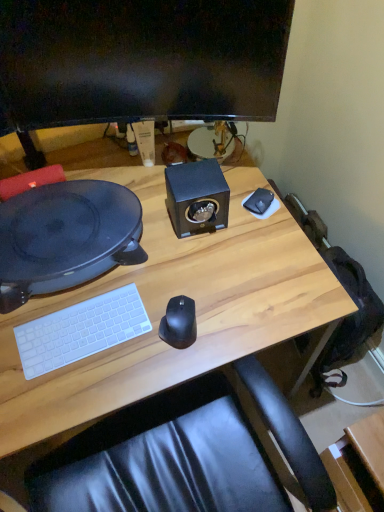
I want to click on free space in front of black plastic record player at left, so click(x=83, y=357).